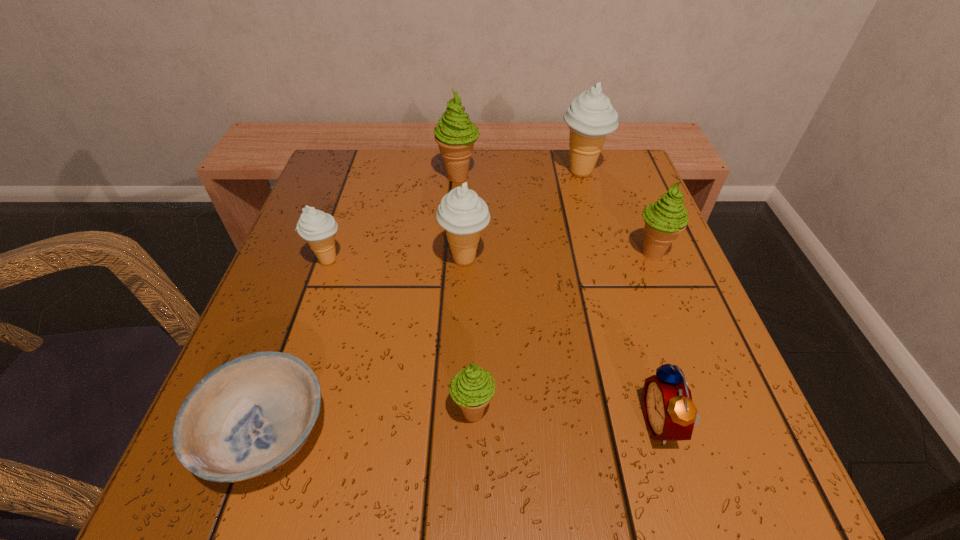
Identify the location of unoccupied area between the alarm clock and the farthest beige icecream. The width and height of the screenshot is (960, 540). (622, 298).

Where is `unoccupied area between the biggest green icecream and the second nearest green icecream`? unoccupied area between the biggest green icecream and the second nearest green icecream is located at coordinates (556, 215).

Identify the location of free spot between the second farthest green icecream and the red alarm clock. (658, 339).

You are a GUI agent. You are given a task and a screenshot of the screen. Output one action in this format:
    pyautogui.click(x=<x>, y=<y>)
    Task: Click on the free point between the rightmost green icecream and the leftmost beige icecream
    
    Given the screenshot: What is the action you would take?
    pyautogui.click(x=490, y=257)

Where is `vacant space in between the farthest green icecream and the smallest green icecream`? vacant space in between the farthest green icecream and the smallest green icecream is located at coordinates (466, 294).

At what (x,y) coordinates should I click in order to perform the action: click on vacant area between the bowl and the farthest green icecream. Please return your answer as a coordinate pair (x, y). The width and height of the screenshot is (960, 540). Looking at the image, I should click on (363, 305).

Where is `the closest object to the second biggest beige icecream`? The height and width of the screenshot is (540, 960). the closest object to the second biggest beige icecream is located at coordinates (318, 228).

Locate which object ranks seventh in proximity to the rightmost beige icecream. Please provide its 2D coordinates. Your answer should be formatted as a tuple, i.e. [(x, y)], where the tuple contains the x and y coordinates of a point satisfying the conditions above.

[(247, 417)]

At what (x,y) coordinates should I click in order to perform the action: click on icecream that can be found as the closest to the second beige icecream from right to left. Please return your answer as a coordinate pair (x, y). The width and height of the screenshot is (960, 540). Looking at the image, I should click on (318, 228).

Identify which icecream is the fourth closest to the leftmost beige icecream. Please provide its 2D coordinates. Your answer should be formatted as a tuple, i.e. [(x, y)], where the tuple contains the x and y coordinates of a point satisfying the conditions above.

[(590, 117)]